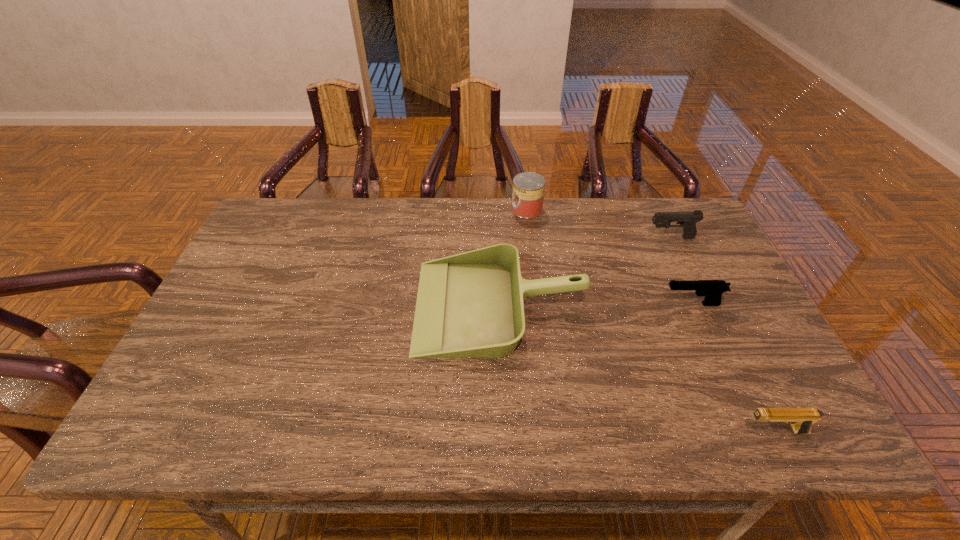
This screenshot has height=540, width=960. I want to click on vacant point located at the barrel of the farthest pistol, so click(570, 238).

This screenshot has width=960, height=540. I want to click on vacant space located at the barrel of the farthest pistol, so click(564, 238).

In order to click on vacant space located 0.380m on the front-facing side of the second nearest pistol in this screenshot , I will do `click(519, 304)`.

Where is `vacant space located 0.080m on the front-facing side of the second nearest pistol`? vacant space located 0.080m on the front-facing side of the second nearest pistol is located at coordinates (632, 304).

At what (x,y) coordinates should I click in order to perform the action: click on free spot located on the front-facing side of the second nearest pistol. Please return your answer as a coordinate pair (x, y). Looking at the image, I should click on (546, 304).

I want to click on vacant area located at the barrel of the nearest object, so click(551, 431).

The image size is (960, 540). I want to click on blank area located at the barrel of the nearest object, so click(x=670, y=431).

What are the coordinates of `vacant space located at the barrel of the nearest object` in the screenshot? It's located at (708, 431).

Locate an element on the screen. can that is at the far edge is located at coordinates (528, 188).

At what (x,y) coordinates should I click in order to perform the action: click on pistol present at the far edge. Please return your answer as a coordinate pair (x, y). This screenshot has width=960, height=540. Looking at the image, I should click on (687, 220).